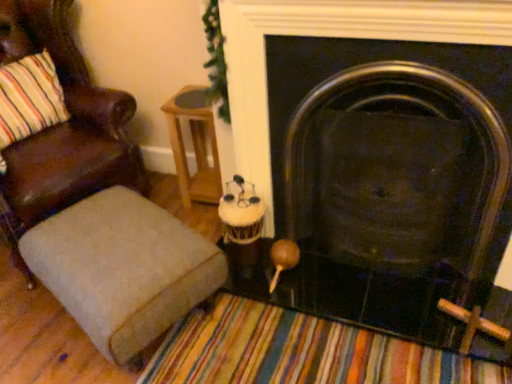
Describe the element at coordinates (194, 146) in the screenshot. I see `woodenside table at center` at that location.

Measure the distance between brown leather chair at left and camera.

brown leather chair at left is 1.63 meters away from camera.

You are a GUI agent. You are given a task and a screenshot of the screen. Output one action in this format:
    pyautogui.click(x=<x>, y=<y>)
    Task: Click on the black metal fireplace at center
    The image size is (512, 384).
    Given the screenshot: What is the action you would take?
    tap(331, 36)

Is black metal fireplace at center positioned with its back to woodenside table at center?

No, woodenside table at center is not at the back of black metal fireplace at center.

Which is in front, point (431, 36) or point (211, 111)?

The point (431, 36) is in front.

Find the location of a particular element. fireplace that is on the right side of woodenside table at center is located at coordinates (331, 36).

Consider the image. Can you tell me how much black metal fireplace at center and brown leather chair at left differ in facing direction?

black metal fireplace at center and brown leather chair at left are facing 71.3 degrees away from each other.

Locate an element on the screen. Image resolution: width=512 pixels, height=384 pixels. fireplace lying in front of the brown leather chair at left is located at coordinates (331, 36).

Consider the image. How distant is black metal fireplace at center from brown leather chair at left?

They are 35.53 inches apart.

Who is bigger, black metal fireplace at center or brown leather chair at left?

brown leather chair at left is bigger.

Which is more to the right, brown leather chair at left or black metal fireplace at center?

From the viewer's perspective, black metal fireplace at center appears more on the right side.

Is black metal fireplace at center a part of brown leather chair at left?

No, black metal fireplace at center is located outside of brown leather chair at left.

Looking at this image, how much distance is there between brown leather chair at left and black metal fireplace at center?

brown leather chair at left and black metal fireplace at center are 90.23 centimeters apart.

Between brown leather chair at left and black metal fireplace at center, which one has smaller width?

Thinner between the two is black metal fireplace at center.

Consider the image. Can you confirm if textured beige ottoman at lower left is positioned to the left of brown leather chair at left?

In fact, textured beige ottoman at lower left is to the right of brown leather chair at left.

From a real-world perspective, which is physically below, textured beige ottoman at lower left or brown leather chair at left?

In real-world perspective, textured beige ottoman at lower left is lower.

From the image's perspective, is textured beige ottoman at lower left under brown leather chair at left?

Yes, from the image's perspective, textured beige ottoman at lower left is below brown leather chair at left.

Is the surface of textured beige ottoman at lower left in direct contact with brown leather chair at left?

They are not placed beside each other.

Is point (64, 183) in front of point (216, 178)?

Yes, point (64, 183) is in front of point (216, 178).

From the image's perspective, who appears lower, brown leather chair at left or woodenside table at center?

woodenside table at center.

The image size is (512, 384). I want to click on chair in front of the woodenside table at center, so click(x=64, y=123).

Can you confirm if brown leather chair at left is positioned to the right of woodenside table at center?

In fact, brown leather chair at left is to the left of woodenside table at center.

Is textured beige ottoman at lower left beside woodenside table at center?

No, textured beige ottoman at lower left is not next to woodenside table at center.

Between textured beige ottoman at lower left and woodenside table at center, which one has larger width?

With larger width is textured beige ottoman at lower left.

Where is `furniture to the left of woodenside table at center`? furniture to the left of woodenside table at center is located at coordinates (123, 268).

Considering the sizes of textured beige ottoman at lower left and woodenside table at center in the image, is textured beige ottoman at lower left bigger or smaller than woodenside table at center?

Clearly, textured beige ottoman at lower left is larger in size than woodenside table at center.

Can you tell me how much woodenside table at center and brown leather chair at left differ in facing direction?

They differ by 67.7 degrees in their facing directions.

Considering the sizes of objects woodenside table at center and brown leather chair at left in the image provided, who is thinner, woodenside table at center or brown leather chair at left?

Thinner between the two is woodenside table at center.

Is point (188, 177) closer or farther from the camera than point (9, 61)?

Point (188, 177).

From the image's perspective, relative to brown leather chair at left, is woodenside table at center above or below?

Clearly, from the image's perspective, woodenside table at center is below brown leather chair at left.

Find the location of a particular element. side table directly beneath the black metal fireplace at center (from a real-world perspective) is located at coordinates (194, 146).

The height and width of the screenshot is (384, 512). Find the location of `fireplace lying in front of the brown leather chair at left`. fireplace lying in front of the brown leather chair at left is located at coordinates (331, 36).

Which object lies further to the anchor point textured beige ottoman at lower left, black metal fireplace at center or brown leather chair at left?

Based on the image, black metal fireplace at center appears to be further to textured beige ottoman at lower left.

Looking at the image, which one is located closer to brown leather chair at left, black metal fireplace at center or textured beige ottoman at lower left?

textured beige ottoman at lower left.

Which object lies nearer to the anchor point woodenside table at center, black metal fireplace at center or textured beige ottoman at lower left?

The object closer to woodenside table at center is black metal fireplace at center.

From the image, which object appears to be nearer to textured beige ottoman at lower left, brown leather chair at left or black metal fireplace at center?

Based on the image, brown leather chair at left appears to be nearer to textured beige ottoman at lower left.

When comparing their distances from brown leather chair at left, does textured beige ottoman at lower left or black metal fireplace at center seem further?

black metal fireplace at center is further to brown leather chair at left.

Considering their positions, is woodenside table at center positioned closer to brown leather chair at left than black metal fireplace at center?

Among the two, woodenside table at center is located nearer to brown leather chair at left.

From the image, which object appears to be farther from textured beige ottoman at lower left, black metal fireplace at center or woodenside table at center?

The object further to textured beige ottoman at lower left is woodenside table at center.

Looking at the image, which one is located closer to black metal fireplace at center, woodenside table at center or brown leather chair at left?

Based on the image, woodenside table at center appears to be nearer to black metal fireplace at center.

Locate an element on the screen. side table situated between textured beige ottoman at lower left and black metal fireplace at center from left to right is located at coordinates (194, 146).

At what (x,y) coordinates should I click in order to perform the action: click on furniture between brown leather chair at left and black metal fireplace at center from left to right. Please return your answer as a coordinate pair (x, y). The image size is (512, 384). Looking at the image, I should click on (123, 268).

You are a GUI agent. You are given a task and a screenshot of the screen. Output one action in this format:
    pyautogui.click(x=<x>, y=<y>)
    Task: Click on the side table between brown leather chair at left and black metal fireplace at center from left to right
    
    Given the screenshot: What is the action you would take?
    pyautogui.click(x=194, y=146)

Identify the location of furniture situated between brown leather chair at left and woodenside table at center from left to right. (123, 268).